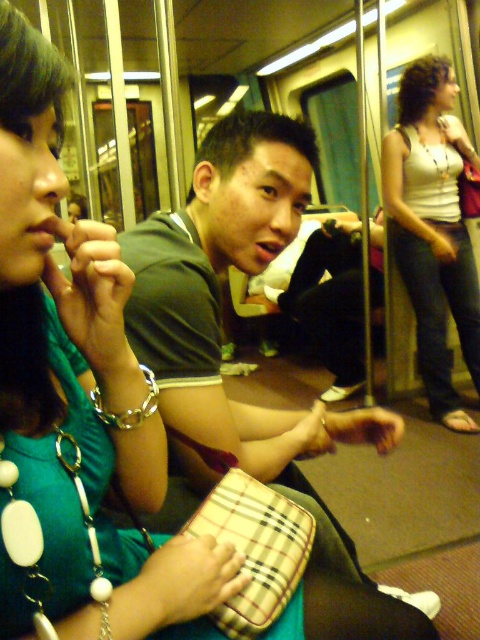
Question: Which of the following is the farthest from the observer?

Choices:
 (A) green matte shirt at center
 (B) white tank top at right

Answer: (B)

Question: Which point is closer to the camera?

Choices:
 (A) green matte shirt at center
 (B) white tank top at right

Answer: (A)

Question: Is the position of green matte shirt at center less distant than that of white tank top at right?

Choices:
 (A) yes
 (B) no

Answer: (A)

Question: From the image, what is the correct spatial relationship of green matte shirt at center in relation to white tank top at right?

Choices:
 (A) left
 (B) right

Answer: (A)

Question: Does green matte shirt at center have a greater width compared to white tank top at right?

Choices:
 (A) yes
 (B) no

Answer: (A)